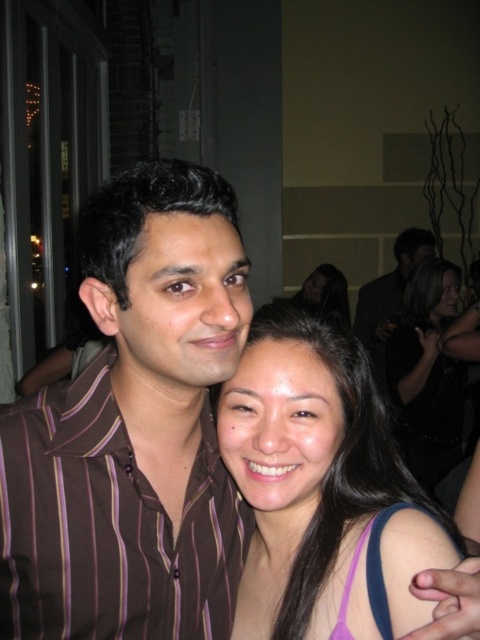
Is point (371, 291) farther from camera compared to point (322, 268)?

Yes.

From the picture: Between dark brown striped shirt at center and smooth black hair at upper right, which one is positioned higher?

dark brown striped shirt at center is higher up.

The image size is (480, 640). Describe the element at coordinates (389, 291) in the screenshot. I see `dark brown striped shirt at center` at that location.

Where is `dark brown striped shirt at center`? The width and height of the screenshot is (480, 640). dark brown striped shirt at center is located at coordinates (389, 291).

Can you confirm if matte purple tank top at center is positioned below smooth black hair at upper right?

Yes.

Who is higher up, matte purple tank top at center or smooth black hair at upper right?

smooth black hair at upper right

The width and height of the screenshot is (480, 640). What do you see at coordinates (307, 468) in the screenshot? I see `matte purple tank top at center` at bounding box center [307, 468].

You are a GUI agent. You are given a task and a screenshot of the screen. Output one action in this format:
    pyautogui.click(x=<x>, y=<y>)
    Task: Click on the matte purple tank top at center
    Image resolution: width=480 pixels, height=640 pixels.
    Given the screenshot: What is the action you would take?
    pyautogui.click(x=307, y=468)

Can you confirm if brown striped shirt at center is bigger than matte purple tank top at center?

No.

Between point (41, 483) and point (333, 595), which one is positioned in front?

Point (41, 483) is in front.

You are a GUI agent. You are given a task and a screenshot of the screen. Output one action in this format:
    pyautogui.click(x=<x>, y=<y>)
    Task: Click on the brown striped shirt at center
    The image size is (480, 640).
    Given the screenshot: What is the action you would take?
    pyautogui.click(x=109, y=525)